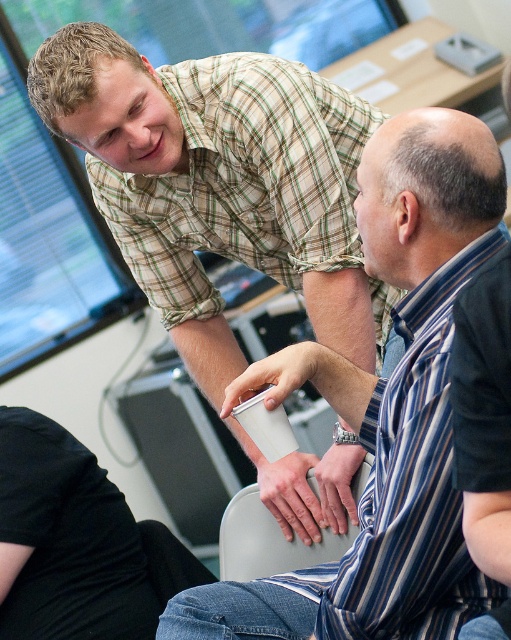
Based on the coordinates provided, which object or feature in the scene is located at point [384,406]?

The point at [384,406] corresponds to the green plaid shirt at upper center.

You are standing in the office scene and want to touch both points. Which point should you reach for first, point (208,387) or point (447,388)?

You should reach for point (208,387) first because it is closer to you than point (447,388).

You are an office assistant who needs to identify the relative positions of two people in the scene. According to the image, which person is closer to you between the matte plaid shirt at upper left and the black fabric shirt at lower left?

The matte plaid shirt at upper left is in front of the black fabric shirt at lower left, so the matte plaid shirt at upper left is closer to you.